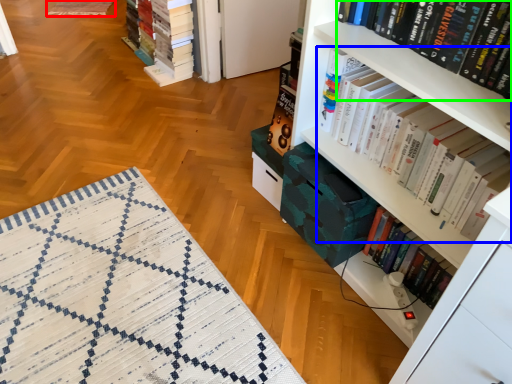
Question: Which object is the closest to the quilt (highlighted by a red box)? Choose among these: book (highlighted by a blue box) or book (highlighted by a green box).

Choices:
 (A) book
 (B) book

Answer: (A)